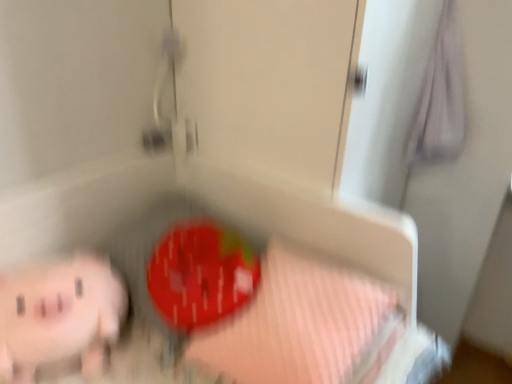
Question: Is the depth of pink rubber piggy bank at lower left greater than that of pink striped fabric at lower center?

Choices:
 (A) no
 (B) yes

Answer: (B)

Question: From a real-world perspective, is pink rubber piggy bank at lower left below pink striped fabric at lower center?

Choices:
 (A) no
 (B) yes

Answer: (B)

Question: From the image's perspective, is pink rubber piggy bank at lower left below pink striped fabric at lower center?

Choices:
 (A) no
 (B) yes

Answer: (B)

Question: Does pink rubber piggy bank at lower left have a smaller size compared to pink striped fabric at lower center?

Choices:
 (A) no
 (B) yes

Answer: (B)

Question: Is pink rubber piggy bank at lower left outside of pink striped fabric at lower center?

Choices:
 (A) yes
 (B) no

Answer: (A)

Question: Does pink rubber piggy bank at lower left have a lesser height compared to pink striped fabric at lower center?

Choices:
 (A) yes
 (B) no

Answer: (A)

Question: Does pink striped fabric at lower center appear on the right side of pink rubber piggy bank at lower left?

Choices:
 (A) no
 (B) yes

Answer: (B)

Question: From a real-world perspective, is pink striped fabric at lower center positioned under pink rubber piggy bank at lower left based on gravity?

Choices:
 (A) yes
 (B) no

Answer: (B)

Question: Considering the relative sizes of pink striped fabric at lower center and pink rubber piggy bank at lower left in the image provided, is pink striped fabric at lower center bigger than pink rubber piggy bank at lower left?

Choices:
 (A) yes
 (B) no

Answer: (A)

Question: Is pink striped fabric at lower center oriented towards pink rubber piggy bank at lower left?

Choices:
 (A) yes
 (B) no

Answer: (B)

Question: Is pink striped fabric at lower center not within pink rubber piggy bank at lower left?

Choices:
 (A) no
 (B) yes

Answer: (B)

Question: From the image's perspective, is pink striped fabric at lower center under pink rubber piggy bank at lower left?

Choices:
 (A) no
 (B) yes

Answer: (A)

Question: Would you say pink striped fabric at lower center is to the left or to the right of pink rubber piggy bank at lower left in the picture?

Choices:
 (A) right
 (B) left

Answer: (A)